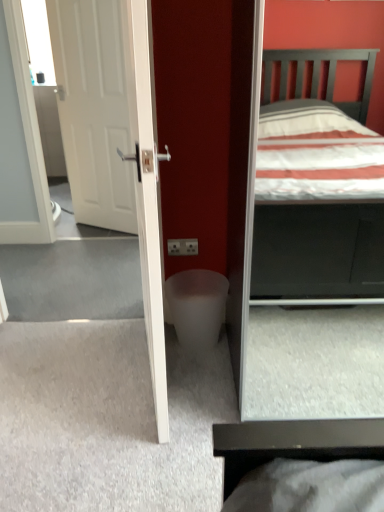
Question: Should I look upward or downward to see white matte door at left?

Choices:
 (A) down
 (B) up

Answer: (B)

Question: Does white frosted glass at center have a lesser width compared to white matte door at left?

Choices:
 (A) no
 (B) yes

Answer: (A)

Question: Is the depth of white frosted glass at center less than that of white matte door at left?

Choices:
 (A) yes
 (B) no

Answer: (A)

Question: Can you confirm if white frosted glass at center is taller than white matte door at left?

Choices:
 (A) no
 (B) yes

Answer: (A)

Question: Is white frosted glass at center outside of white matte door at left?

Choices:
 (A) no
 (B) yes

Answer: (B)

Question: From a real-world perspective, is white frosted glass at center located beneath white matte door at left?

Choices:
 (A) yes
 (B) no

Answer: (A)

Question: Could you tell me if white frosted glass at center is turned towards white matte door at left?

Choices:
 (A) no
 (B) yes

Answer: (A)

Question: From the image's perspective, would you say white matte door at left is shown under white frosted glass at center?

Choices:
 (A) no
 (B) yes

Answer: (A)

Question: Does white matte door at left have a greater width compared to white frosted glass at center?

Choices:
 (A) yes
 (B) no

Answer: (B)

Question: Does white matte door at left have a lesser width compared to white frosted glass at center?

Choices:
 (A) no
 (B) yes

Answer: (B)

Question: Is white frosted glass at center located within white matte door at left?

Choices:
 (A) yes
 (B) no

Answer: (B)

Question: From a real-world perspective, is white matte door at left positioned over white frosted glass at center based on gravity?

Choices:
 (A) yes
 (B) no

Answer: (A)

Question: Is white matte door at left directly adjacent to white frosted glass at center?

Choices:
 (A) no
 (B) yes

Answer: (A)

Question: In the image, is white matte door at left positioned in front of or behind white frosted glass at center?

Choices:
 (A) front
 (B) behind

Answer: (B)